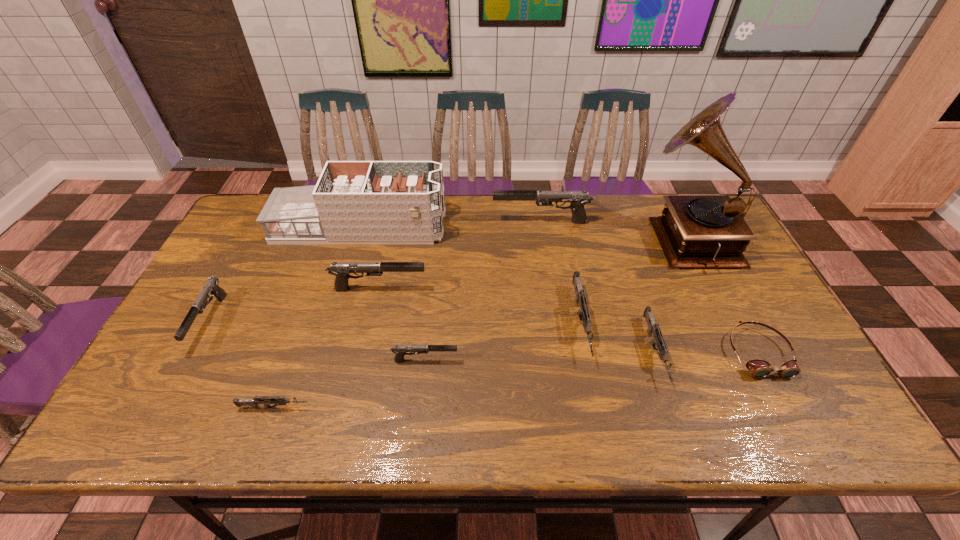
Find the location of a particular element. The image size is (960, 540). vacant region located 0.330m at the muzzle end of the rightmost gray gun is located at coordinates (393, 222).

This screenshot has width=960, height=540. What are the coordinates of `vacant point located 0.310m at the muzzle end of the rightmost gray gun` in the screenshot? It's located at (398, 222).

Find the location of a particular element. This screenshot has width=960, height=540. vacant space located at the muzzle end of the rightmost gray gun is located at coordinates (405, 222).

At what (x,y) coordinates should I click in order to perform the action: click on vacant area situated at the muzzle end of the second tallest gun. Please return your answer as a coordinate pair (x, y). The width and height of the screenshot is (960, 540). Looking at the image, I should click on (466, 288).

Where is `free space located aimed along the barrel of the second grey gun from left to right`? This screenshot has width=960, height=540. free space located aimed along the barrel of the second grey gun from left to right is located at coordinates (598, 409).

Identify the location of vacant space located 0.140m at the muzzle end of the leftmost gun. This screenshot has height=540, width=960. (163, 407).

At what (x,y) coordinates should I click in order to perform the action: click on blank space located 0.100m aimed along the barrel of the rightmost gun. Please return your answer as a coordinate pair (x, y). Image resolution: width=960 pixels, height=540 pixels. Looking at the image, I should click on (681, 431).

At what (x,y) coordinates should I click in order to perform the action: click on vacant area situated 0.150m at the muzzle end of the nearest gray gun. Please return your answer as a coordinate pair (x, y). The width and height of the screenshot is (960, 540). Looking at the image, I should click on (518, 360).

Where is `blank space located aimed along the barrel of the shortest gun`? The image size is (960, 540). blank space located aimed along the barrel of the shortest gun is located at coordinates (488, 408).

Where is `record player present at the far edge`? Image resolution: width=960 pixels, height=540 pixels. record player present at the far edge is located at coordinates (694, 231).